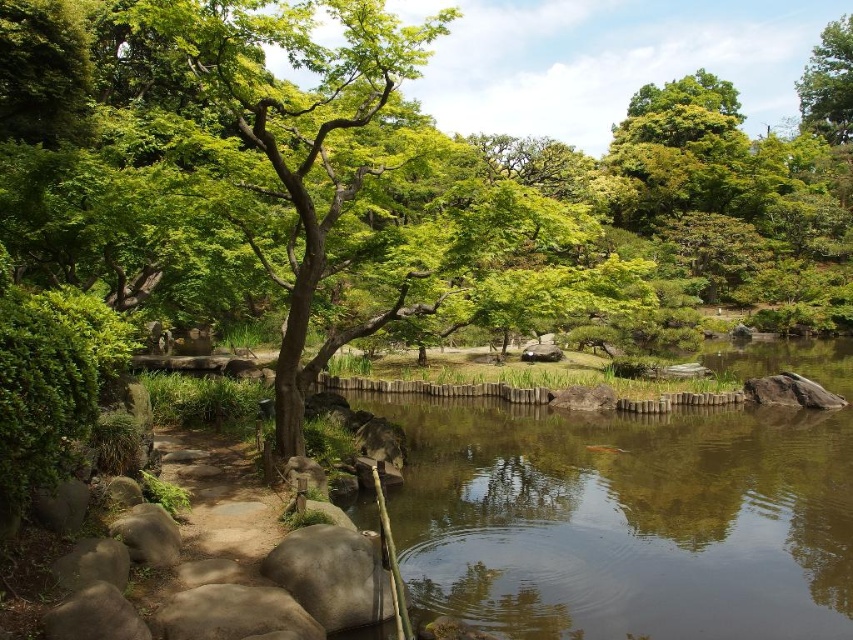
Which is in front, point (811, 484) or point (846, 109)?

Point (811, 484) is in front.

I want to click on smooth brown water at center, so click(x=633, y=513).